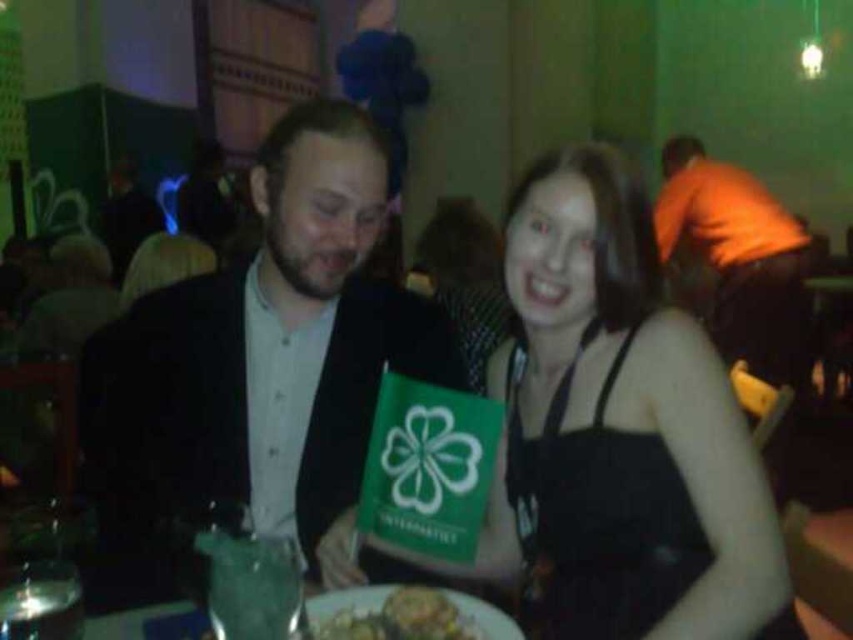
In the scene shown: Can you confirm if matte green flag at center is shorter than matte black suit at center?

Yes, matte green flag at center is shorter than matte black suit at center.

Does matte green flag at center have a lesser width compared to matte black suit at center?

Correct, matte green flag at center's width is less than matte black suit at center's.

Describe the element at coordinates (619, 432) in the screenshot. I see `matte green flag at center` at that location.

This screenshot has width=853, height=640. Find the location of `matte green flag at center`. matte green flag at center is located at coordinates (619, 432).

Describe the element at coordinates (619, 432) in the screenshot. The width and height of the screenshot is (853, 640). I see `matte green flag at center` at that location.

Is matte green flag at center bigger than orange fabric shirt at upper right?

No, matte green flag at center is not bigger than orange fabric shirt at upper right.

You are a GUI agent. You are given a task and a screenshot of the screen. Output one action in this format:
    pyautogui.click(x=<x>, y=<y>)
    Task: Click on the matte green flag at center
    The height and width of the screenshot is (640, 853).
    Given the screenshot: What is the action you would take?
    pyautogui.click(x=619, y=432)

Find the location of a particular element. matte green flag at center is located at coordinates (619, 432).

Is point (668, 314) closer to camera compared to point (450, 620)?

No.

Can you confirm if matte green flag at center is shorter than yellowish matte plate at lower center?

No, matte green flag at center is not shorter than yellowish matte plate at lower center.

Who is more distant from viewer, (498, 392) or (405, 609)?

Point (498, 392)

The image size is (853, 640). Identify the location of matte green flag at center. (619, 432).